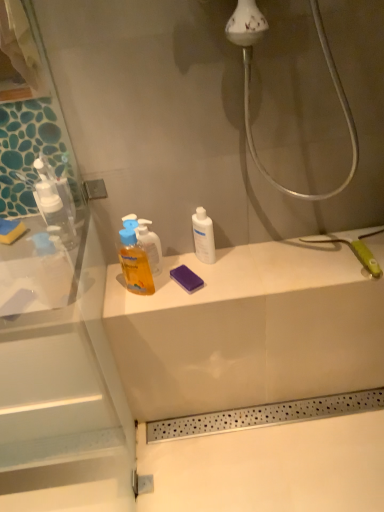
What do you see at coordinates (203, 236) in the screenshot? I see `white matte bottle at center` at bounding box center [203, 236].

Identify the location of white matte bottle at center. (203, 236).

Locate an element on the screen. translucent plastic bottle at center is located at coordinates (134, 261).

What do you see at coordinates (134, 261) in the screenshot? The height and width of the screenshot is (512, 384). I see `translucent plastic bottle at center` at bounding box center [134, 261].

The width and height of the screenshot is (384, 512). Identify the location of white matte bottle at center. (203, 236).

Does white matte bottle at center appear on the right side of translucent plastic bottle at center?

Yes, white matte bottle at center is to the right of translucent plastic bottle at center.

Considering the relative positions of white matte bottle at center and translucent plastic bottle at center in the image provided, is white matte bottle at center in front of translucent plastic bottle at center?

No, white matte bottle at center is further to the viewer.

Which point is more forward, (204, 242) or (125, 248)?

The point (125, 248) is in front.

From the image's perspective, relative to translucent plastic bottle at center, is white matte bottle at center above or below?

white matte bottle at center is above translucent plastic bottle at center.

From a real-world perspective, between white matte bottle at center and translucent plastic bottle at center, who is vertically higher?

translucent plastic bottle at center is physically above.

Is white matte bottle at center wider than translucent plastic bottle at center?

Incorrect, the width of white matte bottle at center does not surpass that of translucent plastic bottle at center.

Which of these two, white matte bottle at center or translucent plastic bottle at center, stands taller?

translucent plastic bottle at center.

Between white matte bottle at center and translucent plastic bottle at center, which one has smaller size?

white matte bottle at center is smaller.

Is white matte bottle at center located outside translucent plastic bottle at center?

That's correct, white matte bottle at center is outside of translucent plastic bottle at center.

Is white matte bottle at center positioned far away from translucent plastic bottle at center?

No.

Is white matte bottle at center positioned with its back to translucent plastic bottle at center?

No.

The height and width of the screenshot is (512, 384). I want to click on mouthwash below the translucent plastic bottle at center (from a real-world perspective), so click(203, 236).

Does translucent plastic bottle at center appear on the left side of white matte bottle at center?

Yes, translucent plastic bottle at center is to the left of white matte bottle at center.

Considering their positions, is translucent plastic bottle at center located in front of or behind white matte bottle at center?

translucent plastic bottle at center is positioned closer to the viewer than white matte bottle at center.

Does point (136, 239) come farther from viewer compared to point (204, 216)?

No.

Looking at this image, from the image's perspective, is translucent plastic bottle at center on white matte bottle at center?

No, from the image's perspective, translucent plastic bottle at center is not on top of white matte bottle at center.

From a real-world perspective, between translucent plastic bottle at center and white matte bottle at center, who is vertically lower?

white matte bottle at center, from a real-world perspective.

Does translucent plastic bottle at center have a lesser width compared to white matte bottle at center?

No.

Does translucent plastic bottle at center have a lesser height compared to white matte bottle at center?

No.

Which of these two, translucent plastic bottle at center or white matte bottle at center, is bigger?

translucent plastic bottle at center is bigger.

Would you say white matte bottle at center is part of translucent plastic bottle at center's contents?

No, white matte bottle at center is not surrounded by translucent plastic bottle at center.

Is translucent plastic bottle at center with white matte bottle at center?

No, translucent plastic bottle at center is not with white matte bottle at center.

Is translucent plastic bottle at center oriented towards white matte bottle at center?

No, translucent plastic bottle at center is not turned towards white matte bottle at center.

What's the angular difference between translucent plastic bottle at center and white matte bottle at center's facing directions?

They differ by 31.2 degrees in their facing directions.

Where is `mouthwash above the translucent plastic bottle at center (from the image's perspective)`? The height and width of the screenshot is (512, 384). mouthwash above the translucent plastic bottle at center (from the image's perspective) is located at coordinates (203, 236).

Find the location of a particular element. mouthwash located above the translucent plastic bottle at center (from the image's perspective) is located at coordinates 203,236.

In order to click on mouthwash directly beneath the translucent plastic bottle at center (from a real-world perspective) in this screenshot , I will do `click(203, 236)`.